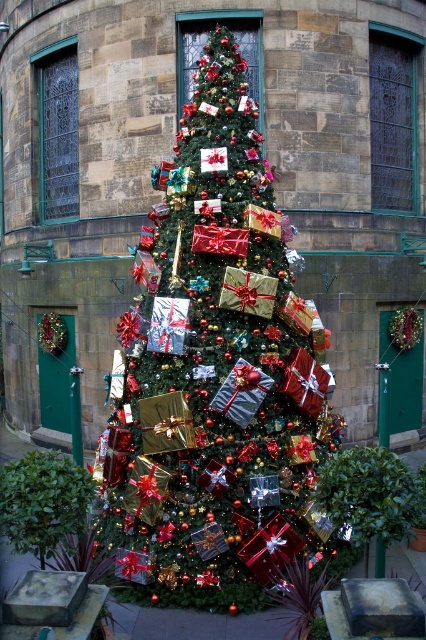
Question: Can you confirm if shiny metallic tree at center is positioned above green leafy bush at lower left?

Choices:
 (A) no
 (B) yes

Answer: (B)

Question: Considering the relative positions of shiny metallic tree at center and green leafy bush at lower left in the image provided, where is shiny metallic tree at center located with respect to green leafy bush at lower left?

Choices:
 (A) above
 (B) below

Answer: (A)

Question: Is shiny metallic tree at center positioned at the back of green leafy bush at lower left?

Choices:
 (A) yes
 (B) no

Answer: (A)